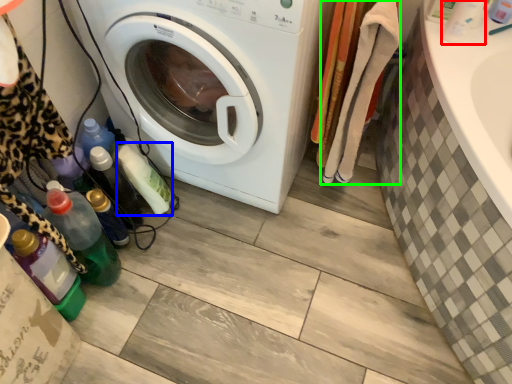
Question: Considering the real-world distances, which object is farthest from bottle (highlighted by a red box)? bottle (highlighted by a blue box) or clothing (highlighted by a green box)?

Choices:
 (A) bottle
 (B) clothing

Answer: (A)